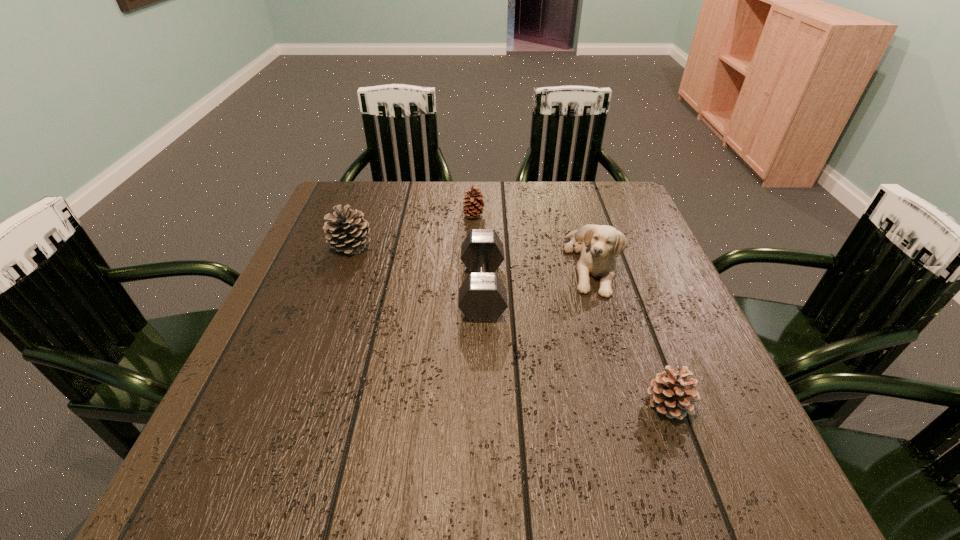
Find the location of a particular element. free spot located 0.080m on the back of the farthest object is located at coordinates (474, 196).

In order to click on vacant area situated on the left of the dumbbell in this screenshot , I will do `click(324, 289)`.

Identify the location of vacant space situated on the back of the nearest object. (612, 251).

Where is `object located in the far edge section of the desktop`? Image resolution: width=960 pixels, height=540 pixels. object located in the far edge section of the desktop is located at coordinates (475, 206).

The image size is (960, 540). Identify the location of object that is positioned at the left edge. (346, 230).

Locate an element on the screen. The height and width of the screenshot is (540, 960). puppy that is at the right edge is located at coordinates (599, 245).

You are a GUI agent. You are given a task and a screenshot of the screen. Output one action in this format:
    pyautogui.click(x=<x>, y=<y>)
    Task: Click on the pinecone positioned at the right edge
    
    Given the screenshot: What is the action you would take?
    pyautogui.click(x=671, y=393)

This screenshot has height=540, width=960. In the image, there is a desktop. Find the location of `vacant space at the far edge`. vacant space at the far edge is located at coordinates (433, 225).

This screenshot has width=960, height=540. In the image, there is a desktop. What are the coordinates of `free space at the near edge` in the screenshot? It's located at (662, 498).

This screenshot has width=960, height=540. I want to click on free point at the left edge, so click(x=348, y=271).